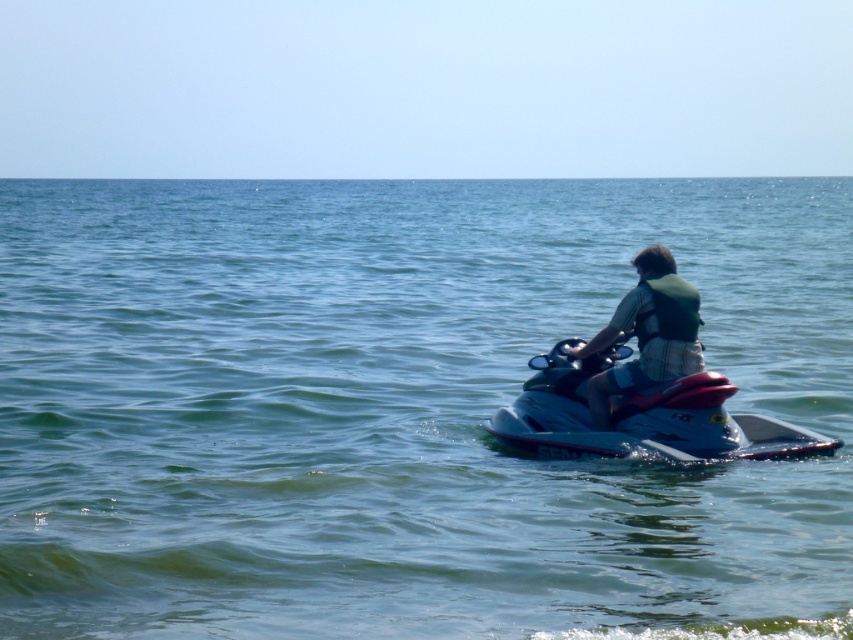
Question: Which point is farther to the camera?

Choices:
 (A) (622, 444)
 (B) (692, 307)
 (C) (212, 211)
 (D) (669, 289)

Answer: (C)

Question: Which of the following is the closest to the observer?

Choices:
 (A) green fabric life vest at center
 (B) green fabric life jacket at center
 (C) metallic blue jet ski at center
 (D) clear blue water at center

Answer: (D)

Question: Can you confirm if clear blue water at center is positioned to the left of metallic blue jet ski at center?

Choices:
 (A) yes
 (B) no

Answer: (A)

Question: Can you confirm if metallic blue jet ski at center is thinner than green fabric life jacket at center?

Choices:
 (A) no
 (B) yes

Answer: (A)

Question: Observing the image, what is the correct spatial positioning of metallic blue jet ski at center in reference to green fabric life vest at center?

Choices:
 (A) left
 (B) right

Answer: (B)

Question: Which of the following is the farthest from the observer?

Choices:
 (A) (648, 285)
 (B) (660, 349)

Answer: (A)